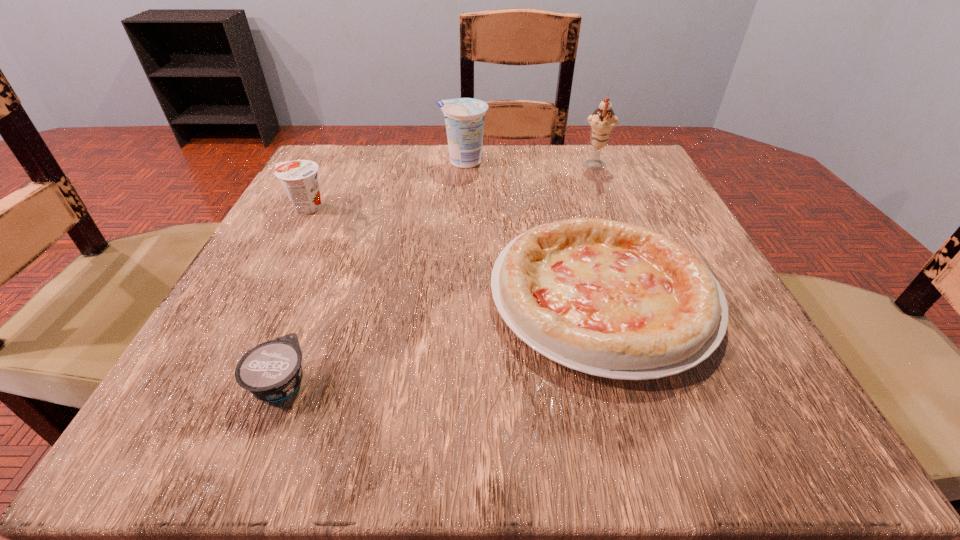
At what (x,y) coordinates should I click in order to perform the action: click on empty space that is in between the tallest object and the tallest yogurt. Please return your answer as a coordinate pair (x, y). Looking at the image, I should click on (530, 164).

Where is `free spot between the second yogurt from left to right and the second farthest yogurt`? The width and height of the screenshot is (960, 540). free spot between the second yogurt from left to right and the second farthest yogurt is located at coordinates point(294,295).

This screenshot has height=540, width=960. Identify the location of free spot between the icecream and the second object from left to right. (439, 274).

At what (x,y) coordinates should I click in order to perform the action: click on vacant space in between the third tallest object and the pizza. Please return your answer as a coordinate pair (x, y). Looking at the image, I should click on tap(454, 251).

I want to click on free area in between the nearest yogurt and the second shortest yogurt, so click(294, 295).

Where is `vacant region between the rightmost yogurt and the second object from left to right`? The image size is (960, 540). vacant region between the rightmost yogurt and the second object from left to right is located at coordinates (372, 272).

Locate an element on the screen. Image resolution: width=960 pixels, height=540 pixels. free area in between the third farthest object and the tallest object is located at coordinates (451, 187).

Locate an element on the screen. This screenshot has height=540, width=960. vacant area that lies between the shortest yogurt and the fourth tallest object is located at coordinates (442, 338).

Identify which object is the nearest to the second tallest object. Please provide its 2D coordinates. Your answer should be formatted as a tuple, i.e. [(x, y)], where the tuple contains the x and y coordinates of a point satisfying the conditions above.

[(602, 122)]

In order to click on the second closest object to the pizza in this screenshot , I will do `click(464, 117)`.